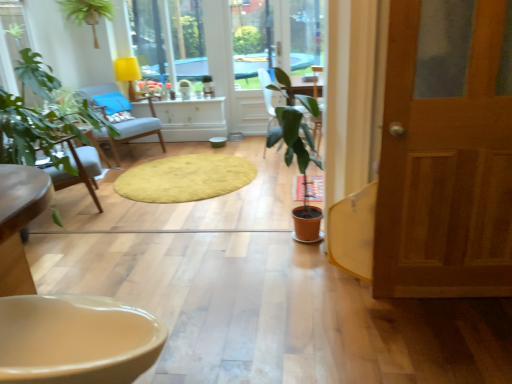
I want to click on vacant region to the left of wooden door at right, so click(x=350, y=310).